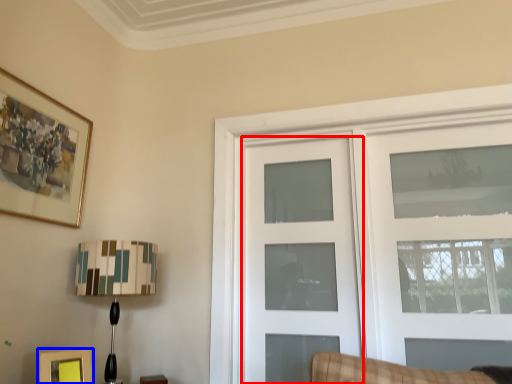
Question: Which point is further to the camera, door (highlighted by a red box) or picture frame (highlighted by a blue box)?

Choices:
 (A) door
 (B) picture frame

Answer: (A)